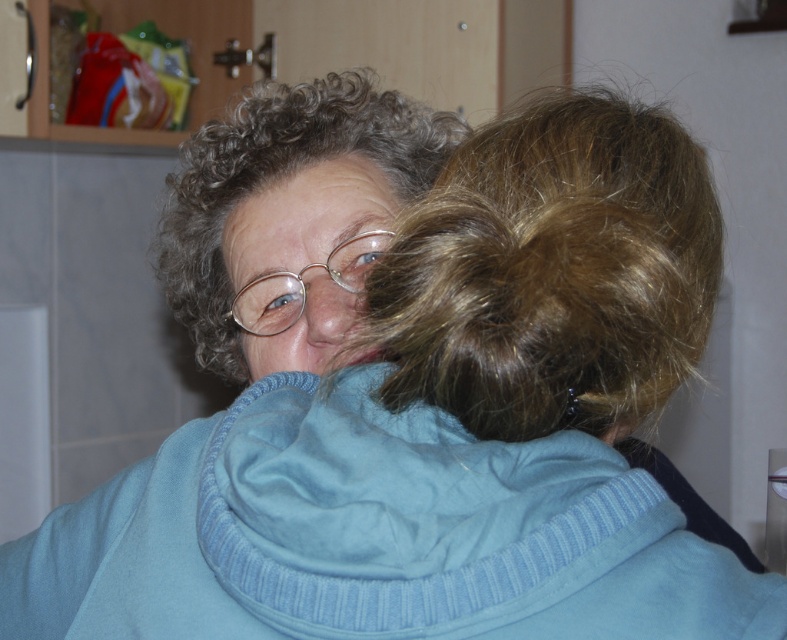
Question: Which point is closer to the camera taking this photo?

Choices:
 (A) tap(514, 356)
 (B) tap(178, 465)

Answer: (A)

Question: Can you confirm if light blue fleece at center is bigger than brown curly hair at upper center?

Choices:
 (A) yes
 (B) no

Answer: (A)

Question: Which of the following is the farthest from the observer?

Choices:
 (A) curly brown hair at center
 (B) brown curly hair at upper center

Answer: (A)

Question: Which point appears farthest from the camera in this image?

Choices:
 (A) (640, 266)
 (B) (198, 157)

Answer: (B)

Question: Does light blue fleece at center appear on the right side of curly brown hair at center?

Choices:
 (A) no
 (B) yes

Answer: (B)

Question: Is light blue fleece at center to the right of brown curly hair at upper center from the viewer's perspective?

Choices:
 (A) no
 (B) yes

Answer: (A)